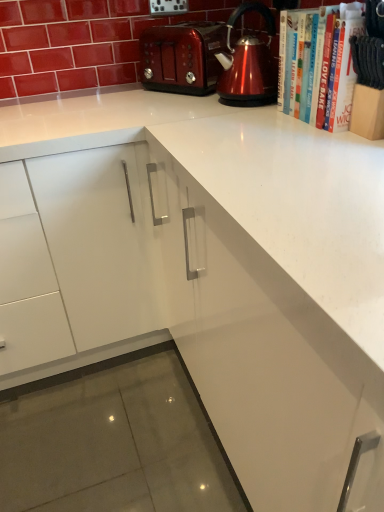
Question: From the image's perspective, is shiny metallic kettle at upper right on top of white paper book at upper right, arranged as the 1th book when viewed from the back?

Choices:
 (A) yes
 (B) no

Answer: (A)

Question: Would you say shiny metallic kettle at upper right is a long distance from white paper book at upper right, arranged as the 1th book when viewed from the back?

Choices:
 (A) yes
 (B) no

Answer: (B)

Question: Can you confirm if shiny metallic kettle at upper right is bigger than white paper book at upper right, placed as the second book when sorted from front to back?

Choices:
 (A) no
 (B) yes

Answer: (A)

Question: Considering the relative sizes of shiny metallic kettle at upper right and white paper book at upper right, placed as the second book when sorted from front to back, in the image provided, is shiny metallic kettle at upper right shorter than white paper book at upper right, placed as the second book when sorted from front to back,?

Choices:
 (A) yes
 (B) no

Answer: (B)

Question: Considering the relative sizes of shiny metallic kettle at upper right and white paper book at upper right, arranged as the 1th book when viewed from the back, in the image provided, is shiny metallic kettle at upper right smaller than white paper book at upper right, arranged as the 1th book when viewed from the back,?

Choices:
 (A) no
 (B) yes

Answer: (B)

Question: Are shiny metallic kettle at upper right and white paper book at upper right, arranged as the 1th book when viewed from the back, making contact?

Choices:
 (A) yes
 (B) no

Answer: (B)

Question: Is white paper book at upper right, placed as the second book when sorted from front to back, facing towards shiny metallic kettle at upper right?

Choices:
 (A) yes
 (B) no

Answer: (B)

Question: Does white paper book at upper right, arranged as the 1th book when viewed from the back, have a greater height compared to shiny metallic kettle at upper right?

Choices:
 (A) yes
 (B) no

Answer: (B)

Question: Is white paper book at upper right, arranged as the 1th book when viewed from the back, shorter than shiny metallic kettle at upper right?

Choices:
 (A) yes
 (B) no

Answer: (A)

Question: From a real-world perspective, does white paper book at upper right, placed as the second book when sorted from front to back, stand above shiny metallic kettle at upper right?

Choices:
 (A) yes
 (B) no

Answer: (B)

Question: Is white paper book at upper right, arranged as the 1th book when viewed from the back, oriented away from shiny metallic kettle at upper right?

Choices:
 (A) no
 (B) yes

Answer: (A)

Question: Considering the relative positions of white paper book at upper right, placed as the second book when sorted from front to back, and shiny metallic kettle at upper right in the image provided, is white paper book at upper right, placed as the second book when sorted from front to back, behind shiny metallic kettle at upper right?

Choices:
 (A) yes
 (B) no

Answer: (B)

Question: Is there a large distance between white paper book at upper right, arranged as the 1th book when viewed from the back, and shiny metallic toaster at upper center?

Choices:
 (A) no
 (B) yes

Answer: (A)